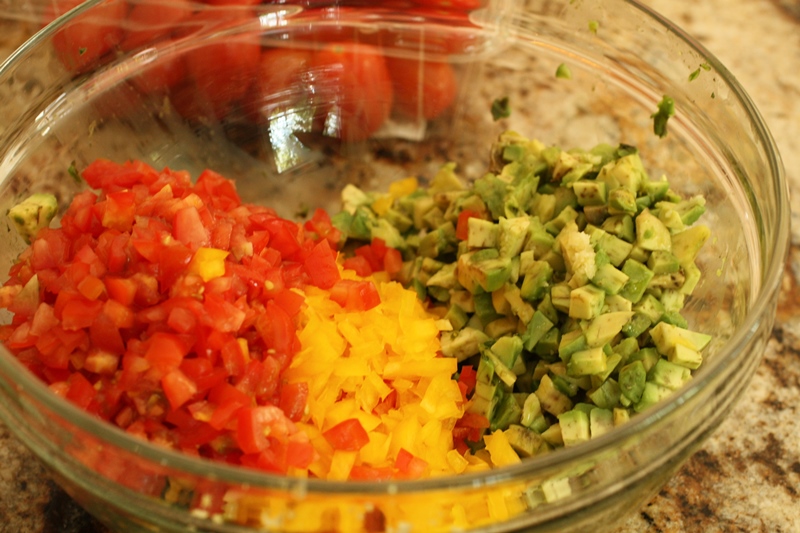
The height and width of the screenshot is (533, 800). Find the location of `glass`. glass is located at coordinates (282, 77).